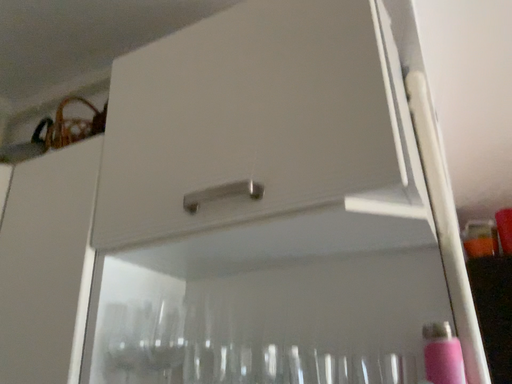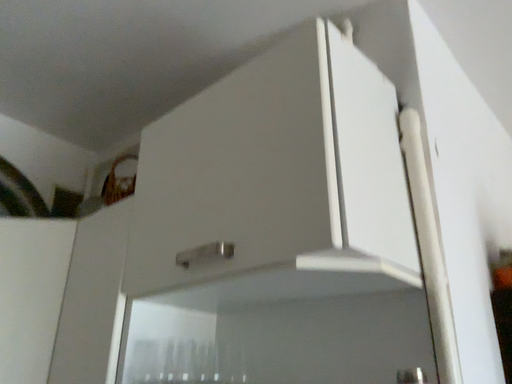
Question: How did the camera likely rotate when shooting the video?

Choices:
 (A) rotated left
 (B) rotated right

Answer: (A)